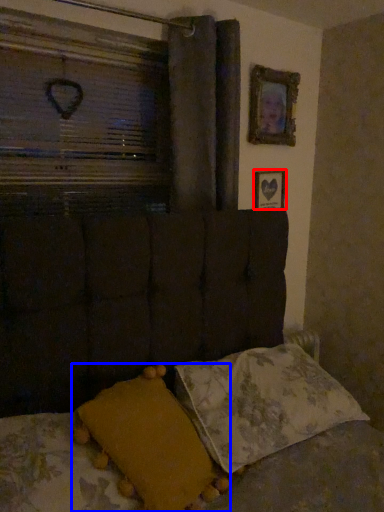
Question: Which object appears farthest to the camera in this image, picture frame (highlighted by a red box) or pillow (highlighted by a blue box)?

Choices:
 (A) picture frame
 (B) pillow

Answer: (A)